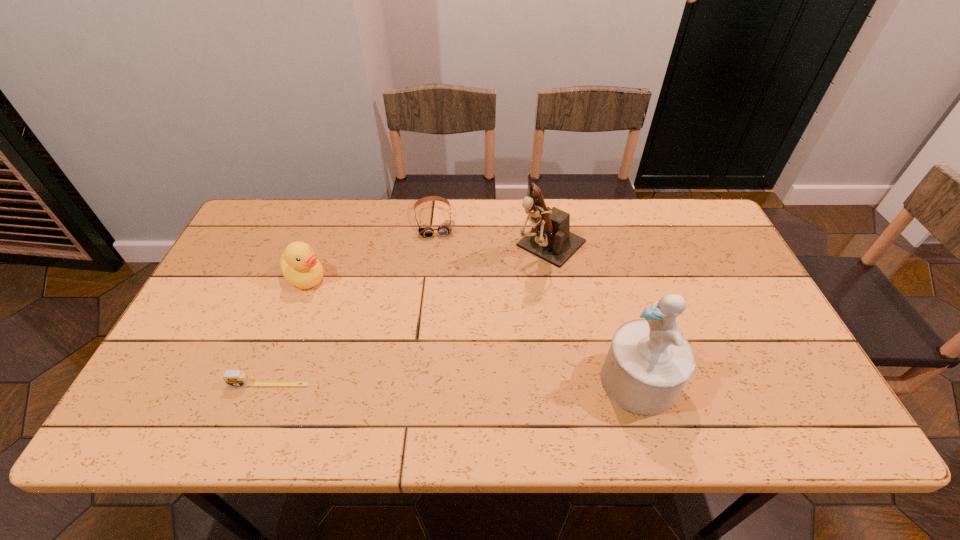
Where is `free point that satisfies the following two spatial constraints: 1. on the back side of the farther figurine; 2. on the right side of the duck`? This screenshot has width=960, height=540. free point that satisfies the following two spatial constraints: 1. on the back side of the farther figurine; 2. on the right side of the duck is located at coordinates (318, 246).